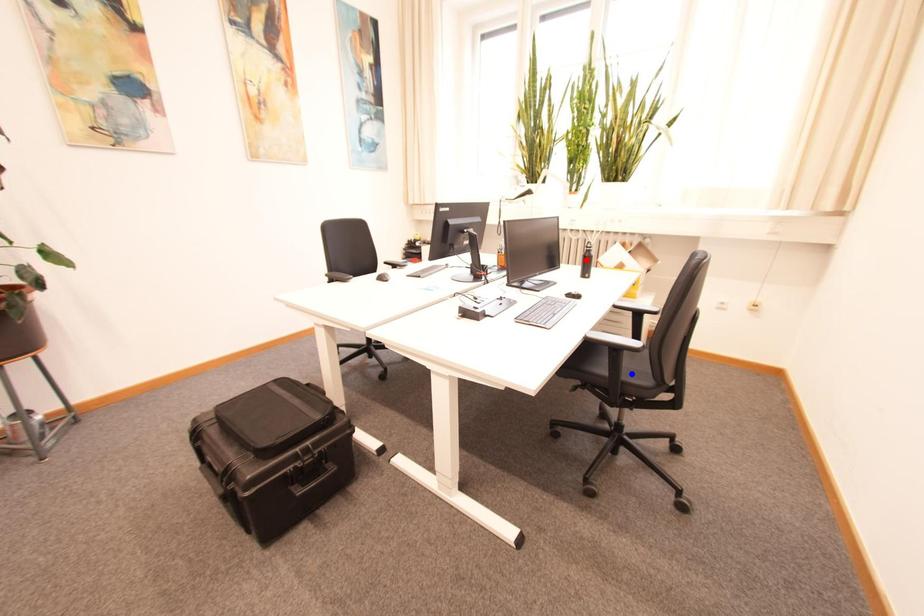
Question: Which of the two points in the image is closer to the camera?

Choices:
 (A) Blue point is closer.
 (B) Red point is closer.

Answer: (A)